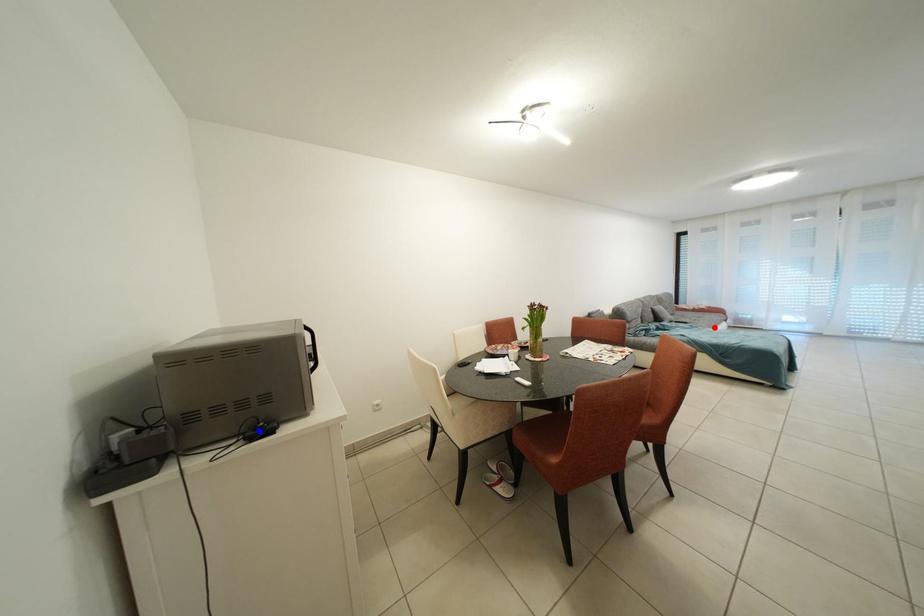
Question: Two points are marked on the image. Which point is closer to the camera?

Choices:
 (A) Blue point is closer.
 (B) Red point is closer.

Answer: (A)